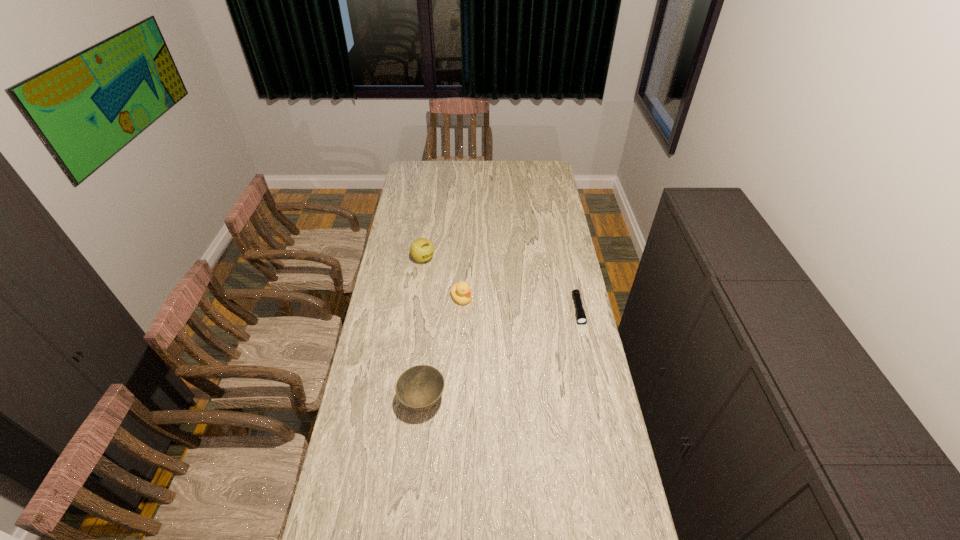
This screenshot has width=960, height=540. In order to click on free space between the duckling and the rightmost object in this screenshot , I will do `click(519, 304)`.

The width and height of the screenshot is (960, 540). I want to click on free space between the bowl and the duckling, so click(443, 349).

The width and height of the screenshot is (960, 540). Find the location of `free space between the duckling and the shortest object`. free space between the duckling and the shortest object is located at coordinates click(519, 304).

The width and height of the screenshot is (960, 540). In order to click on free space that is in between the softball and the flashlight in this screenshot , I will do `click(500, 284)`.

Locate an element on the screen. This screenshot has width=960, height=540. unoccupied position between the duckling and the bowl is located at coordinates (443, 349).

I want to click on vacant area that lies between the duckling and the shortest object, so click(x=519, y=304).

This screenshot has height=540, width=960. Identify the location of blank region between the bowl and the rightmost object. (500, 355).

Identify the location of free spot between the farthest object and the flashlight. (500, 284).

Find the location of a particular element. This screenshot has height=540, width=960. empty location between the rightmost object and the duckling is located at coordinates (519, 304).

This screenshot has width=960, height=540. I want to click on empty space that is in between the duckling and the bowl, so click(443, 349).